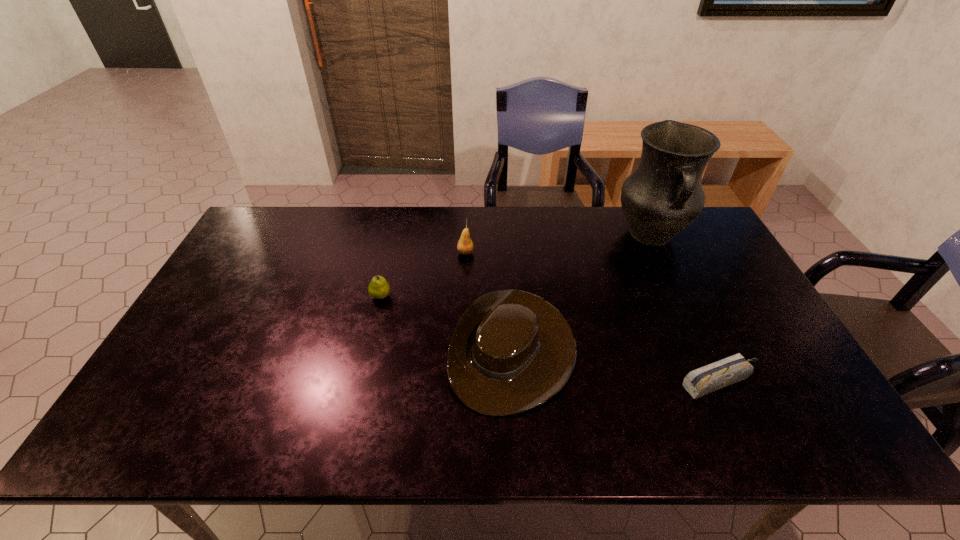
Find the location of `pitcher`. pitcher is located at coordinates (663, 196).

Image resolution: width=960 pixels, height=540 pixels. What are the coordinates of `the second tallest object` in the screenshot? It's located at (465, 246).

At what (x,y) coordinates should I click in order to perform the action: click on the right pear. Please return your answer as a coordinate pair (x, y). Looking at the image, I should click on (465, 246).

You are a GUI agent. You are given a task and a screenshot of the screen. Output one action in this format:
    pyautogui.click(x=<x>, y=<y>)
    Task: Click on the left pear
    The width and height of the screenshot is (960, 540).
    Given the screenshot: What is the action you would take?
    pyautogui.click(x=379, y=288)

Find the location of a particular element. The height and width of the screenshot is (540, 960). the shorter pear is located at coordinates click(x=379, y=288).

Locate an element on the screen. cowboy hat is located at coordinates (511, 351).

Where is `the shortest object`? the shortest object is located at coordinates (702, 381).

Locate an element on the screen. The width and height of the screenshot is (960, 540). vacant space located on the handle side of the tallest object is located at coordinates (699, 340).

This screenshot has height=540, width=960. I want to click on blank area located on the left of the farther pear, so click(x=418, y=253).

Find the location of a particular element. The height and width of the screenshot is (540, 960). free space located 0.390m on the right of the shorter pear is located at coordinates (523, 296).